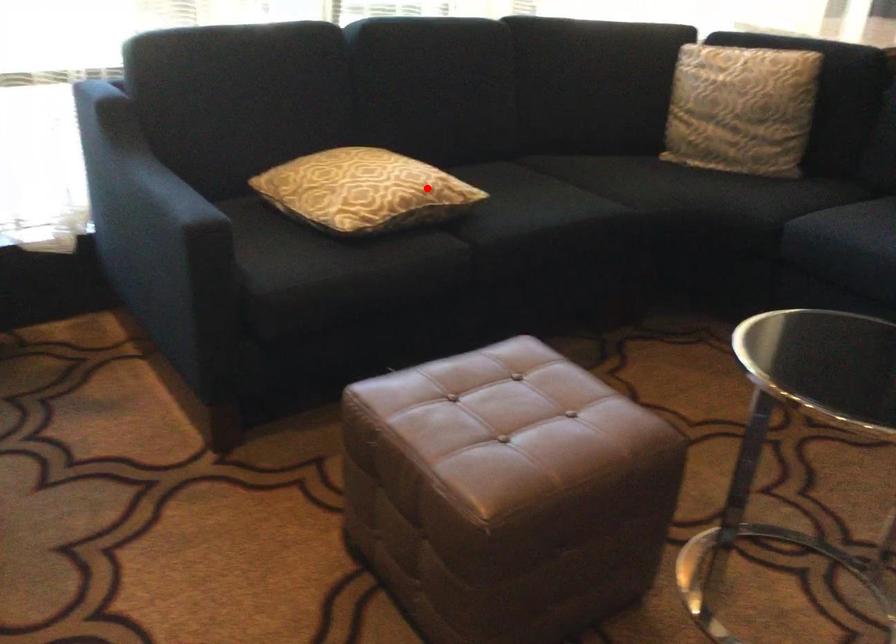
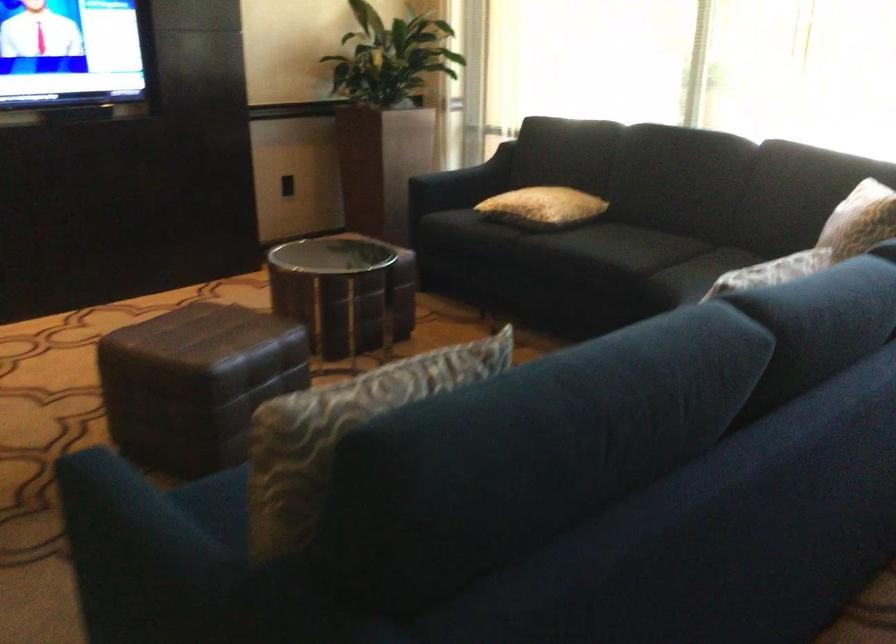
The point at the highlighted location is marked in the first image. Where is the corresponding point in the second image?

(543, 207)